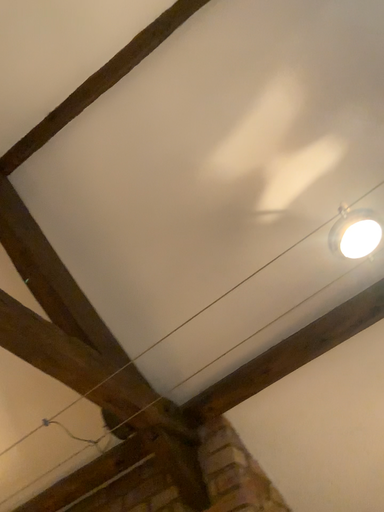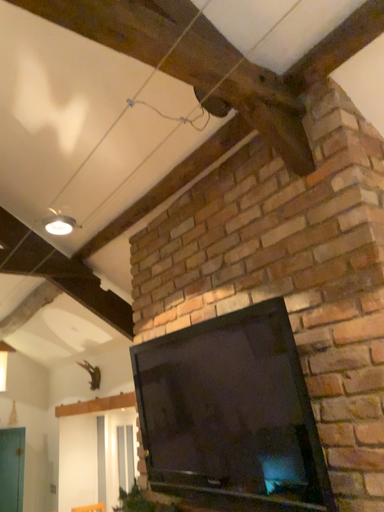
Question: Which way did the camera rotate in the video?

Choices:
 (A) rotated downward
 (B) rotated upward

Answer: (A)